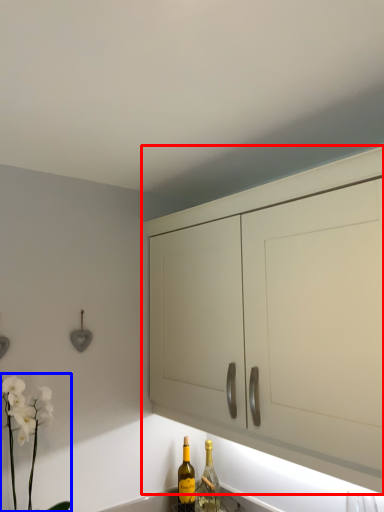
Question: Which of the following is the closest to the observer, cabinetry (highlighted by a red box) or floral arrangement (highlighted by a blue box)?

Choices:
 (A) cabinetry
 (B) floral arrangement

Answer: (A)